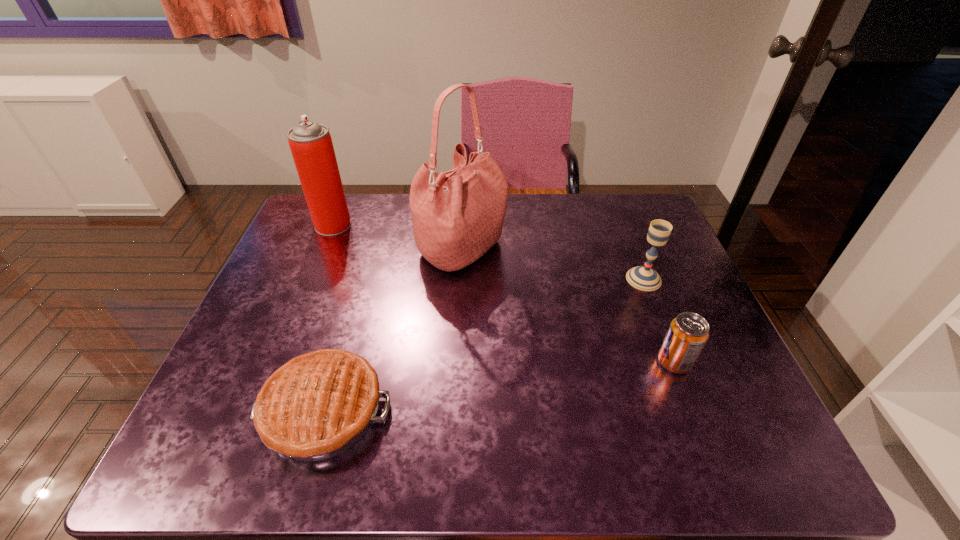
At what (x,y) coordinates should I click in order to perform the action: click on empty space between the third object from right to left and the aerosol can. Please return your answer as a coordinate pair (x, y). The height and width of the screenshot is (540, 960). Looking at the image, I should click on [x=397, y=238].

In order to click on blank region between the tallest object and the second tallest object in this screenshot , I will do `click(397, 238)`.

Locate an element on the screen. The image size is (960, 540). vacant region between the aerosol can and the soda can is located at coordinates (504, 293).

The width and height of the screenshot is (960, 540). I want to click on empty location between the shortest object and the second tallest object, so (x=328, y=318).

Locate an element on the screen. The width and height of the screenshot is (960, 540). vacant point located between the shortest object and the second tallest object is located at coordinates (328, 318).

Identify which object is located as the nearest to the third object from right to left. Please provide its 2D coordinates. Your answer should be formatted as a tuple, i.e. [(x, y)], where the tuple contains the x and y coordinates of a point satisfying the conditions above.

[(311, 145)]

Locate which object is the closest to the soda can. Please provide its 2D coordinates. Your answer should be formatted as a tuple, i.e. [(x, y)], where the tuple contains the x and y coordinates of a point satisfying the conditions above.

[(645, 278)]

Locate an element on the screen. Image resolution: width=960 pixels, height=540 pixels. free region that satisfies the following two spatial constraints: 1. on the back side of the soda can; 2. on the left side of the pie is located at coordinates (338, 361).

At what (x,y) coordinates should I click in order to perform the action: click on vacant space that satisfies the following two spatial constraints: 1. on the front side of the fourth tallest object; 2. on the left side of the fourth shortest object. Please return your answer as a coordinate pair (x, y). Looking at the image, I should click on (277, 361).

The image size is (960, 540). What are the coordinates of `free space that satisfies the following two spatial constraints: 1. on the back side of the shortest object; 2. on the right side of the third shortest object` in the screenshot? It's located at (362, 279).